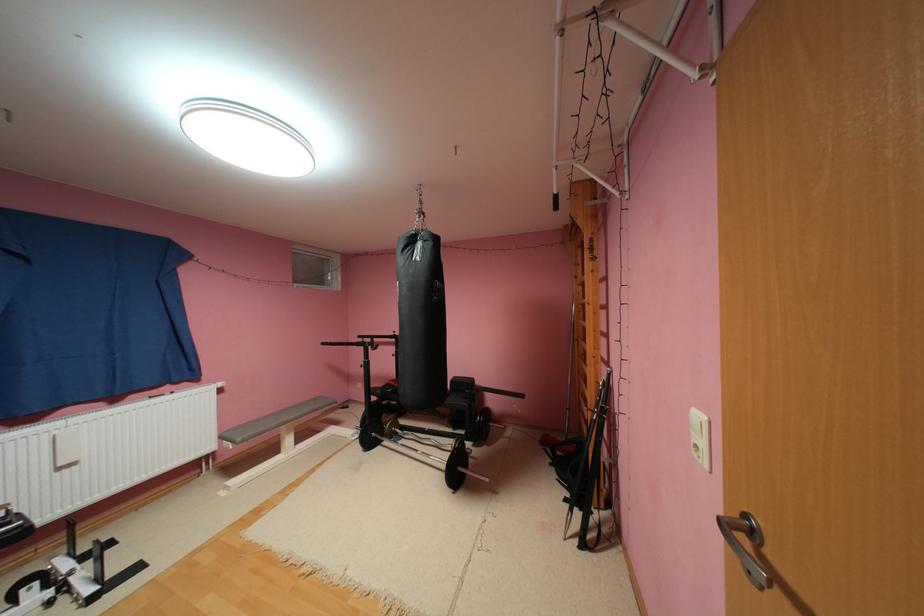
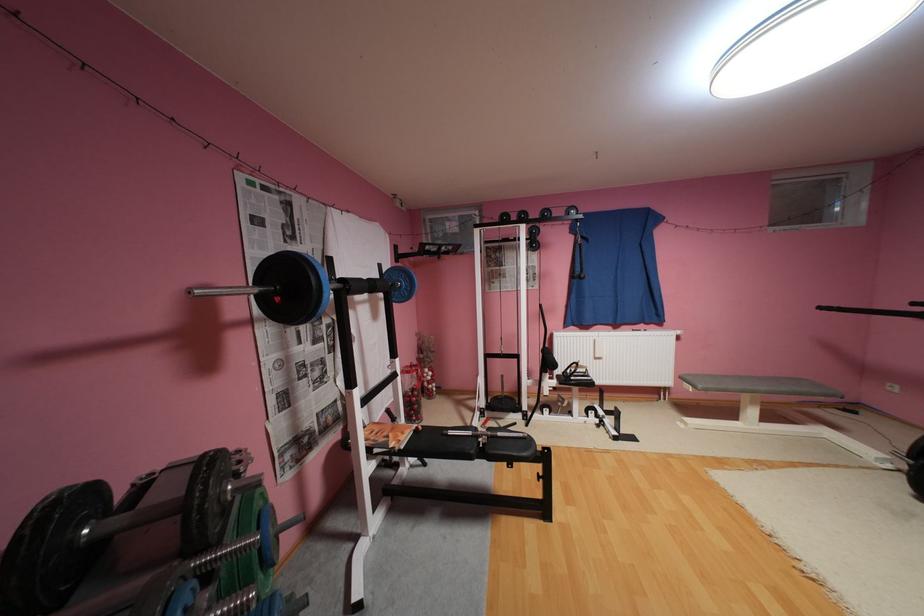
Where in the second image is the point corresponding to pixel 300 416 from the first image?

(771, 387)